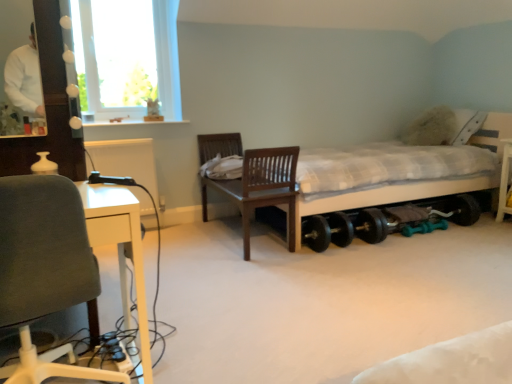
Question: Is white checkered bed at center positioned beyond the bounds of gray fabric chair at left, which appears as the 1th chair when viewed from the left?

Choices:
 (A) yes
 (B) no

Answer: (A)

Question: Is white checkered bed at center to the right of gray fabric chair at left, the first chair when ordered from front to back, from the viewer's perspective?

Choices:
 (A) yes
 (B) no

Answer: (A)

Question: From the image's perspective, is white checkered bed at center below gray fabric chair at left, arranged as the 2th chair when viewed from the back?

Choices:
 (A) yes
 (B) no

Answer: (B)

Question: From the image's perspective, is white checkered bed at center on gray fabric chair at left, positioned as the second chair in right-to-left order?

Choices:
 (A) no
 (B) yes

Answer: (B)

Question: Does white checkered bed at center come behind gray fabric chair at left, the first chair when ordered from front to back?

Choices:
 (A) no
 (B) yes

Answer: (B)

Question: Looking at the image, does gray fabric chair at left, the first chair when ordered from front to back, seem bigger or smaller compared to white glass window at upper left?

Choices:
 (A) small
 (B) big

Answer: (B)

Question: Which is correct: gray fabric chair at left, which appears as the 1th chair when viewed from the left, is inside white glass window at upper left, or outside of it?

Choices:
 (A) outside
 (B) inside

Answer: (A)

Question: Visually, is gray fabric chair at left, positioned as the second chair in right-to-left order, positioned to the left or to the right of white glass window at upper left?

Choices:
 (A) left
 (B) right

Answer: (B)

Question: From the image's perspective, is gray fabric chair at left, which appears as the 1th chair when viewed from the left, above or below white glass window at upper left?

Choices:
 (A) below
 (B) above

Answer: (A)

Question: Is wooden chair at center, the first chair from the back, taller or shorter than black rubber wheel at lower center?

Choices:
 (A) tall
 (B) short

Answer: (A)

Question: Based on their sizes in the image, would you say wooden chair at center, the 2th chair in the front-to-back sequence, is bigger or smaller than black rubber wheel at lower center?

Choices:
 (A) big
 (B) small

Answer: (A)

Question: Is wooden chair at center, placed as the first chair when sorted from right to left, wider or thinner than black rubber wheel at lower center?

Choices:
 (A) thin
 (B) wide

Answer: (B)

Question: Would you say wooden chair at center, the first chair from the back, is inside or outside black rubber wheel at lower center?

Choices:
 (A) outside
 (B) inside

Answer: (A)

Question: Based on their sizes in the image, would you say gray fabric chair at left, the first chair when ordered from front to back, is bigger or smaller than white checkered bed at center?

Choices:
 (A) big
 (B) small

Answer: (B)

Question: From the image's perspective, is gray fabric chair at left, positioned as the second chair in right-to-left order, located above or below white checkered bed at center?

Choices:
 (A) below
 (B) above

Answer: (A)